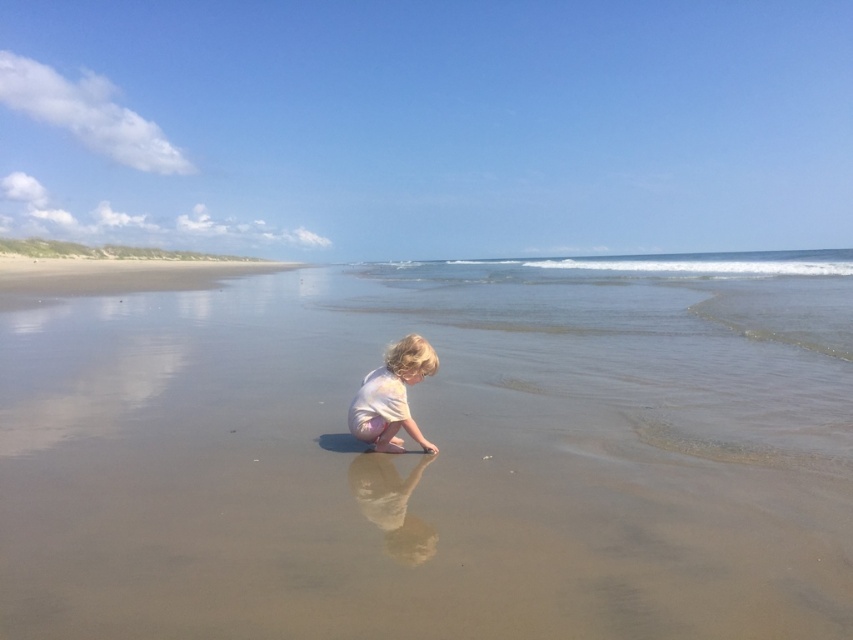
Does smooth sand at center have a lesser width compared to light pink fabric toddler at center?

In fact, smooth sand at center might be wider than light pink fabric toddler at center.

Is smooth sand at center to the right of light pink fabric toddler at center from the viewer's perspective?

Yes, smooth sand at center is to the right of light pink fabric toddler at center.

You are a GUI agent. You are given a task and a screenshot of the screen. Output one action in this format:
    pyautogui.click(x=<x>, y=<y>)
    Task: Click on the smooth sand at center
    This screenshot has height=640, width=853.
    Given the screenshot: What is the action you would take?
    pyautogui.click(x=437, y=454)